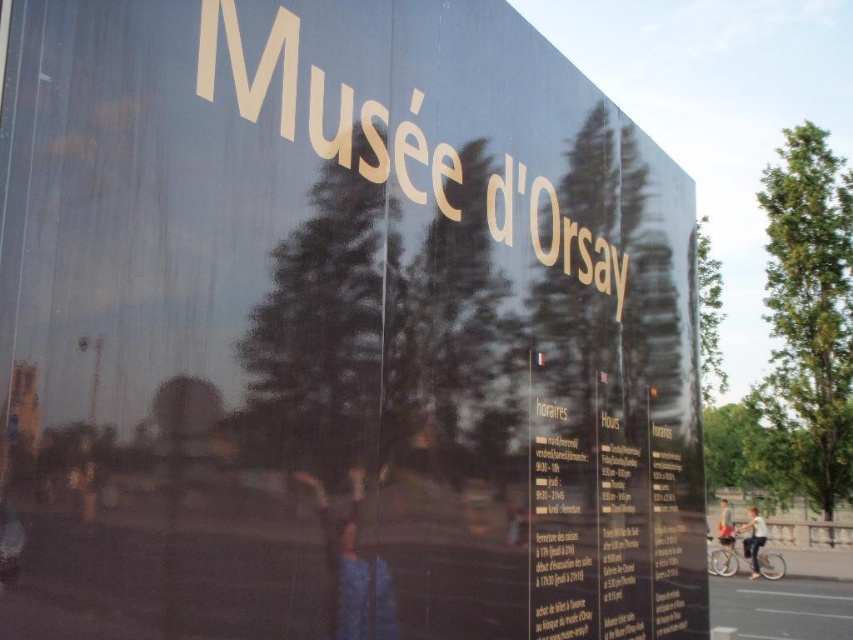
You are a delivery robot with a width of 1.5 meters. You need to pass between the light blue jeans at lower right and the light brown leather jacket at lower right to reach the delivery point. Can you fit through the space between them?

The distance between the light blue jeans at lower right and the light brown leather jacket at lower right is 1.77 meters. Since your width is 1.5 meters, you can fit through the space as it is wider than your robot.

You are standing in front of the Mus??e d???Orsay??s reflective surface and see two points labeled as point ???[761,538]??? and point ???[718,525]??? in the reflection. Which point is nearer to you?

Point ???[761,538]??? is closer to the viewer than point ???[718,525]???.

You are a visitor standing in front of the Mus?e d?Orsay entrance and see the light blue jeans at lower right and the light brown leather jacket at lower right. Which clothing item appears taller in the reflection on the museum entrance?

The light blue jeans at lower right is taller than the light brown leather jacket at lower right in the reflection on the museum entrance.